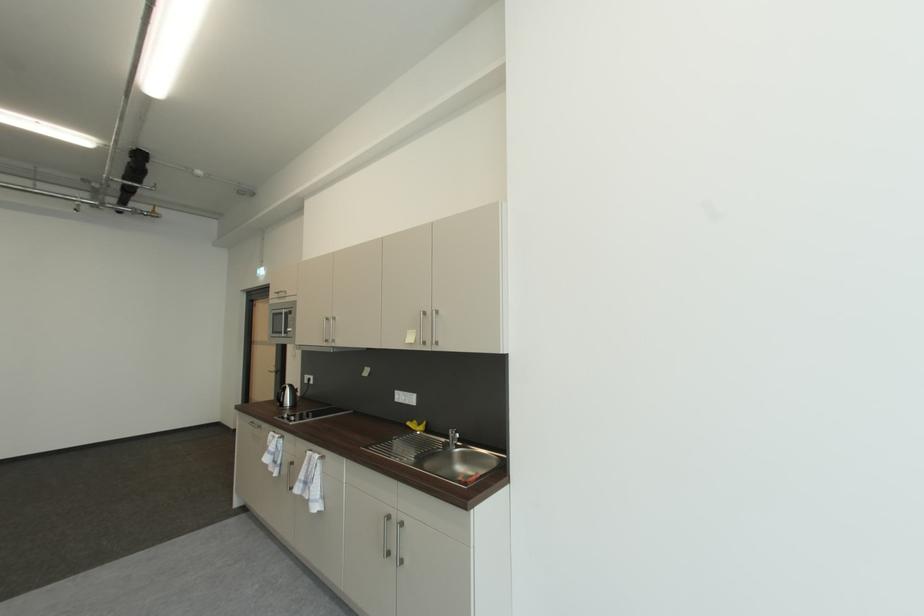
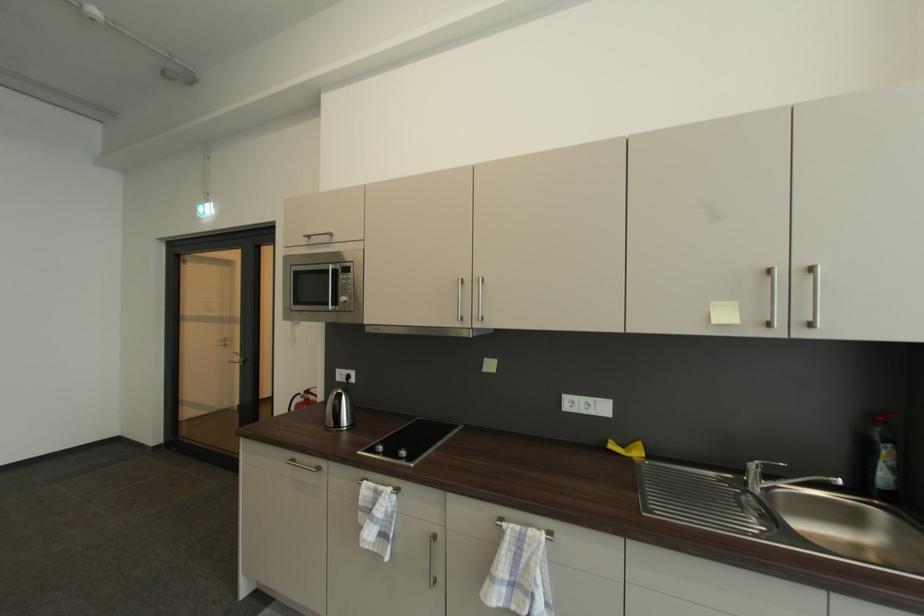
Find the pixel in the second image that matches (x=325, y=456) in the first image.

(545, 531)